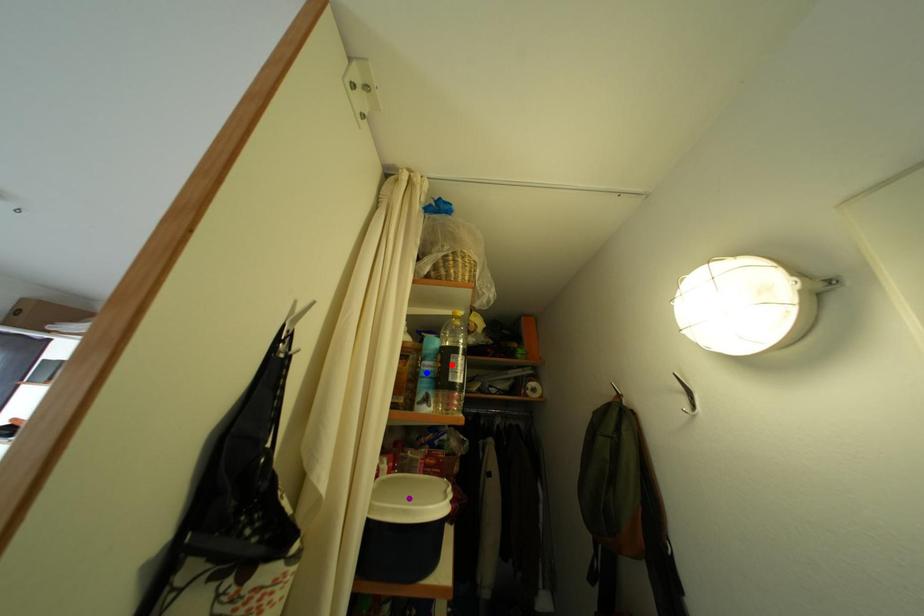
Order these from nearest to farthest:
blue point
purple point
red point

red point < blue point < purple point